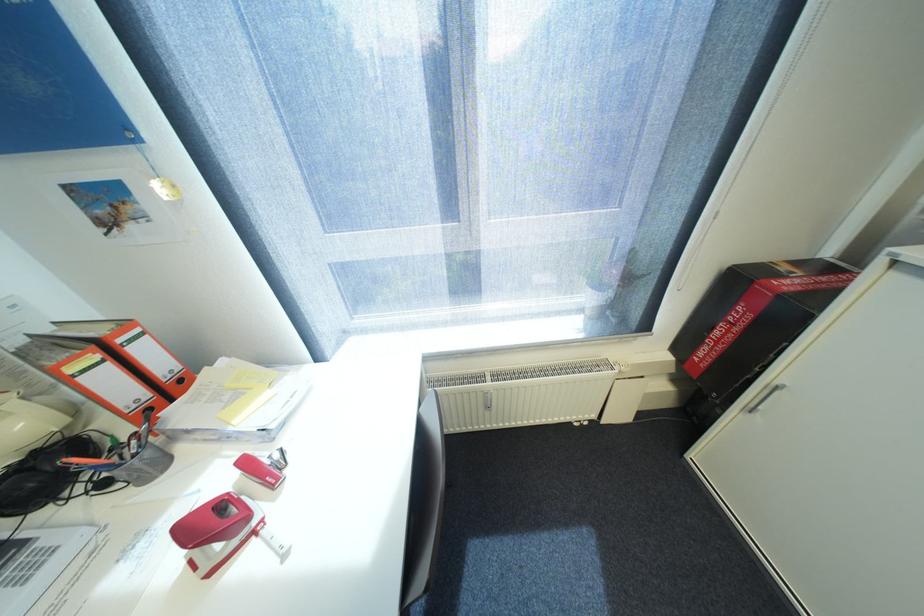
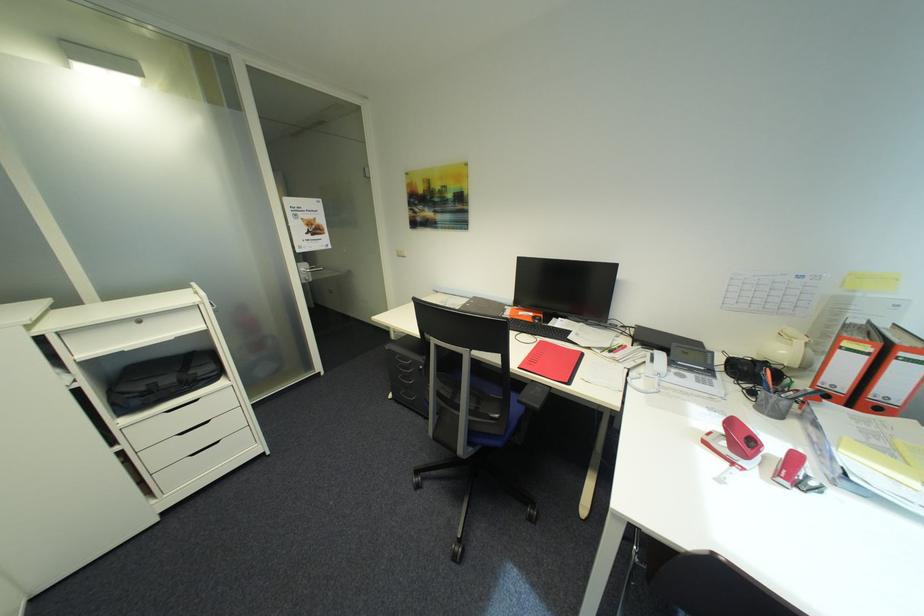
Find the pixel in the second image that matches point (112, 485) in the first image.

(760, 392)